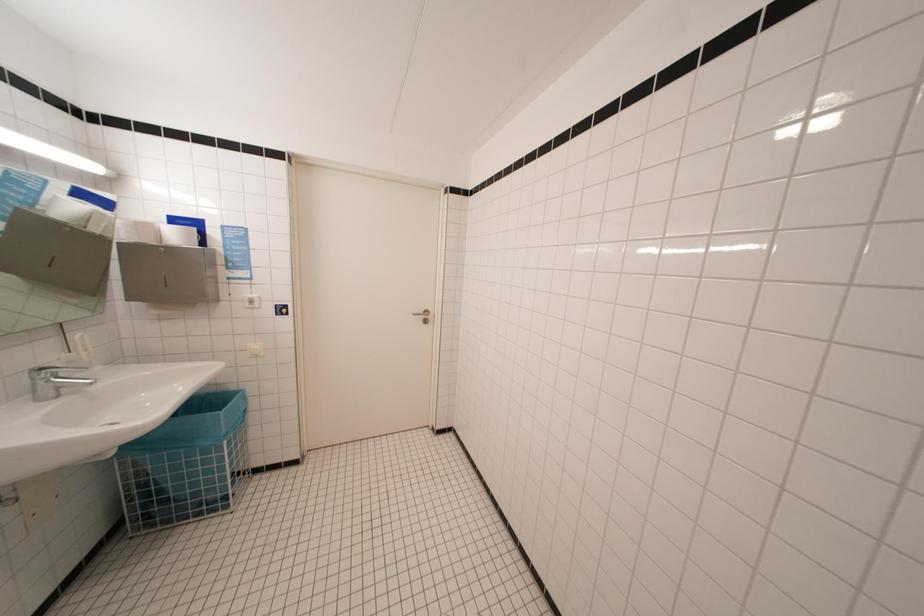
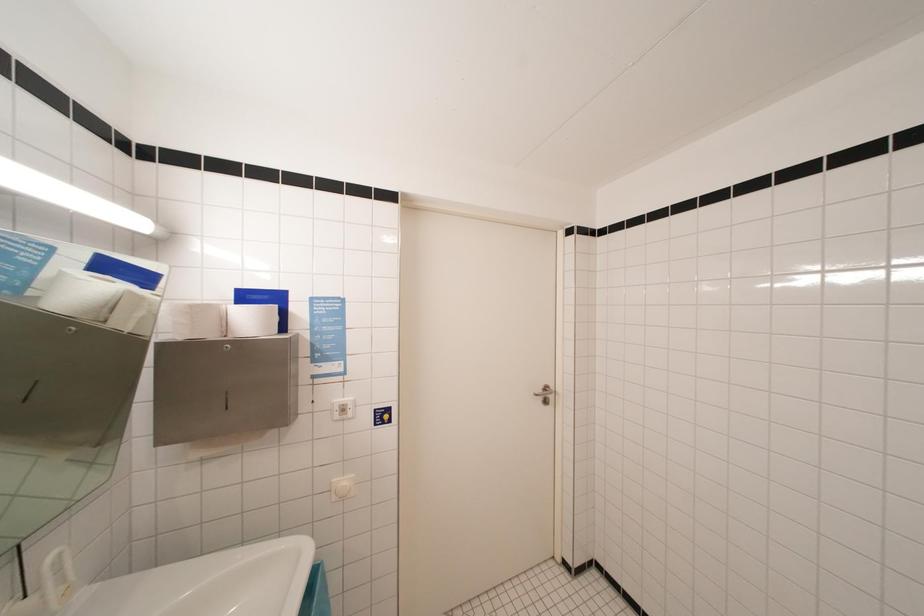
Question: Based on the continuous images, in which direction is the camera rotating? Reply with the corresponding letter.

Choices:
 (A) Left
 (B) Right
 (C) Up
 (D) Down

Answer: (C)